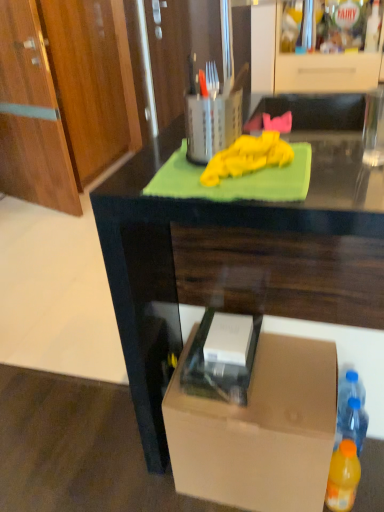
Question: Could dark wood desk at center be considered to be inside orange plastic bottle at lower right, placed as the second bottle when sorted from back to front?

Choices:
 (A) yes
 (B) no

Answer: (B)

Question: Does orange plastic bottle at lower right, placed as the second bottle when sorted from back to front, appear on the left side of dark wood desk at center?

Choices:
 (A) no
 (B) yes

Answer: (A)

Question: Can you confirm if orange plastic bottle at lower right, placed as the second bottle when sorted from back to front, is shorter than dark wood desk at center?

Choices:
 (A) yes
 (B) no

Answer: (A)

Question: Can you confirm if orange plastic bottle at lower right, positioned as the 1th bottle in front-to-back order, is taller than dark wood desk at center?

Choices:
 (A) no
 (B) yes

Answer: (A)

Question: From the image's perspective, would you say orange plastic bottle at lower right, positioned as the 1th bottle in front-to-back order, is shown under dark wood desk at center?

Choices:
 (A) yes
 (B) no

Answer: (A)

Question: From a real-world perspective, is orange plastic bottle at lower right, placed as the second bottle when sorted from back to front, positioned under dark wood desk at center based on gravity?

Choices:
 (A) no
 (B) yes

Answer: (B)

Question: Is orange plastic bottle at lower right, placed as the second bottle when sorted from back to front, positioned in front of metallic silver utensil holder at upper center?

Choices:
 (A) yes
 (B) no

Answer: (B)

Question: Would you say metallic silver utensil holder at upper center is part of orange plastic bottle at lower right, placed as the second bottle when sorted from back to front,'s contents?

Choices:
 (A) yes
 (B) no

Answer: (B)

Question: Is orange plastic bottle at lower right, placed as the second bottle when sorted from back to front, looking in the opposite direction of metallic silver utensil holder at upper center?

Choices:
 (A) no
 (B) yes

Answer: (A)

Question: Does orange plastic bottle at lower right, placed as the second bottle when sorted from back to front, have a smaller size compared to metallic silver utensil holder at upper center?

Choices:
 (A) no
 (B) yes

Answer: (B)

Question: From a real-world perspective, is orange plastic bottle at lower right, placed as the second bottle when sorted from back to front, located beneath metallic silver utensil holder at upper center?

Choices:
 (A) yes
 (B) no

Answer: (A)

Question: Can you confirm if orange plastic bottle at lower right, positioned as the 1th bottle in front-to-back order, is positioned to the right of metallic silver utensil holder at upper center?

Choices:
 (A) yes
 (B) no

Answer: (A)

Question: Is dark wood desk at center next to orange plastic bottle at lower right, placed as the second bottle when sorted from back to front?

Choices:
 (A) yes
 (B) no

Answer: (B)